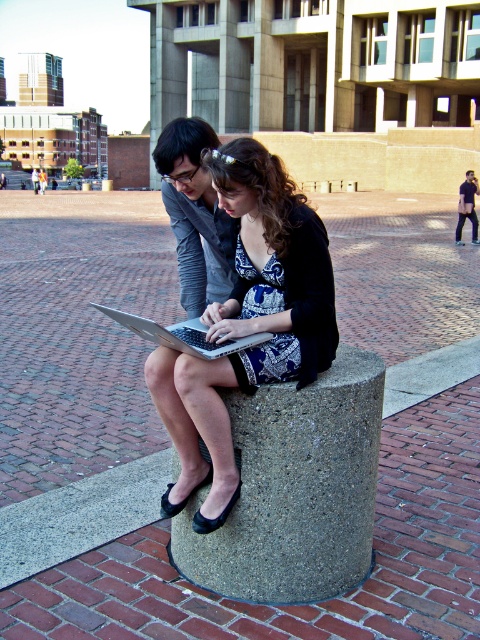
From the picture: Can you confirm if gray concrete at center is wider than silver metallic laptop at center?

Yes.

Describe the element at coordinates (295, 490) in the screenshot. The width and height of the screenshot is (480, 640). I see `gray concrete at center` at that location.

This screenshot has height=640, width=480. Identify the location of gray concrete at center. (295, 490).

The width and height of the screenshot is (480, 640). In order to click on gray concrete at center in this screenshot , I will do `click(295, 490)`.

Which is more to the right, patterned fabric dress at center or silver metallic laptop at center?

From the viewer's perspective, patterned fabric dress at center appears more on the right side.

Is patterned fabric dress at center below silver metallic laptop at center?

Indeed, patterned fabric dress at center is positioned under silver metallic laptop at center.

Where is `patterned fabric dress at center`? patterned fabric dress at center is located at coordinates (248, 323).

Which is behind, point (232, 428) or point (191, 422)?

The point (191, 422) is behind.

Where is `gray concrete at center`? gray concrete at center is located at coordinates (295, 490).